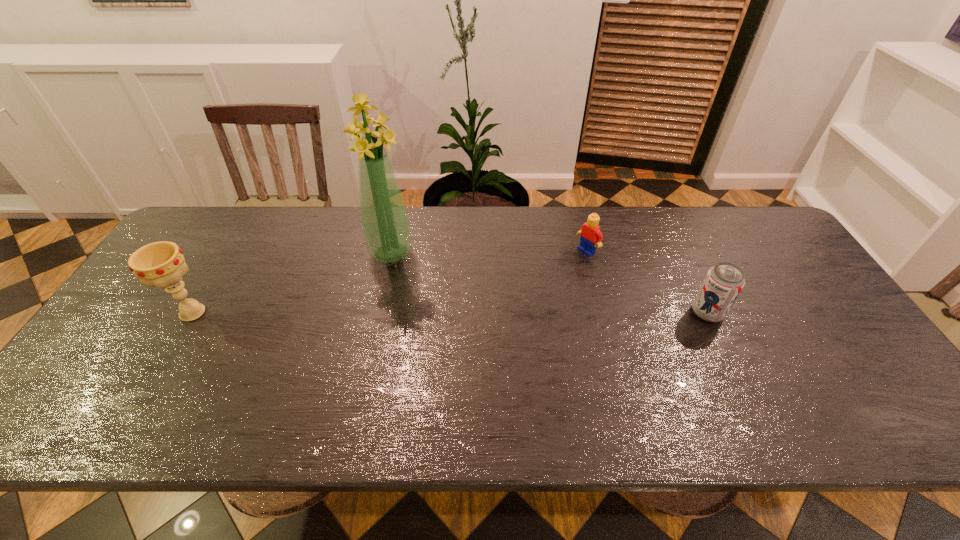
You are a GUI agent. You are given a task and a screenshot of the screen. Output one action in this format:
    pyautogui.click(x=<x>, y=<y>)
    Task: Click on the chalice
    This screenshot has height=540, width=960.
    Given the screenshot: What is the action you would take?
    pyautogui.click(x=160, y=264)

Locate an element on the screen. This screenshot has width=960, height=540. the third shortest object is located at coordinates (160, 264).

I want to click on beer can, so click(x=723, y=283).

This screenshot has height=540, width=960. In order to click on the third object from right to left in this screenshot , I will do `click(386, 227)`.

This screenshot has width=960, height=540. In order to click on the tallest object in this screenshot , I will do `click(386, 227)`.

Where is `Lego`? The width and height of the screenshot is (960, 540). Lego is located at coordinates (591, 236).

Find the location of a particular element. vacant space located on the right of the second tallest object is located at coordinates (232, 313).

This screenshot has width=960, height=540. In order to click on blank area located on the right of the beer can in this screenshot , I will do (805, 313).

Find the location of `blank space located 0.390m on the front-facing side of the bouquet`. blank space located 0.390m on the front-facing side of the bouquet is located at coordinates (438, 372).

The height and width of the screenshot is (540, 960). What are the coordinates of `free space located on the front-facing side of the bouquet` in the screenshot? It's located at (417, 318).